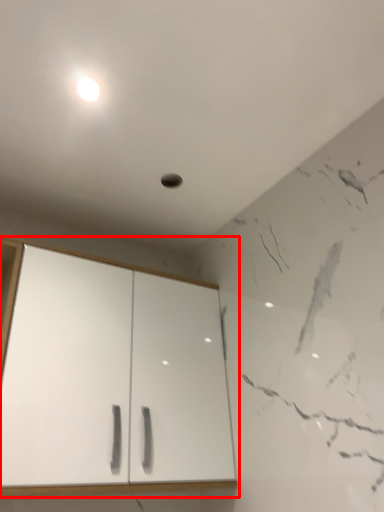
Question: From the image's perspective, considering the relative positions of cupboard (annotated by the red box) and light in the image provided, where is cupboard (annotated by the red box) located with respect to the staircase?

Choices:
 (A) above
 (B) below

Answer: (B)